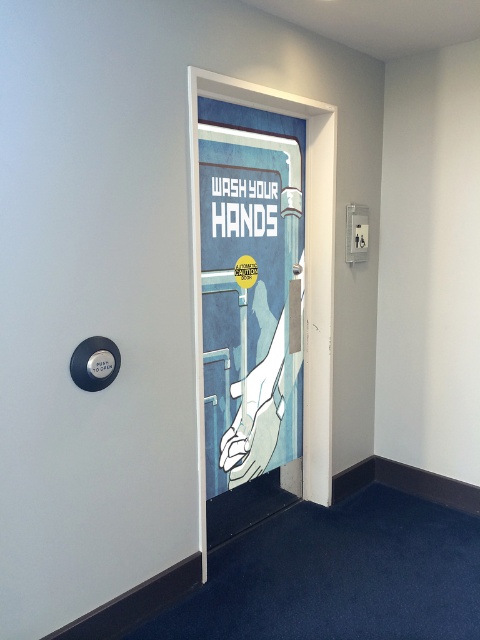
Who is positioned more to the right, white glossy door at center or blue paper poster at center?

blue paper poster at center is more to the right.

In the scene shown: Does white glossy door at center appear on the left side of blue paper poster at center?

Indeed, white glossy door at center is positioned on the left side of blue paper poster at center.

Does point (70, 29) come closer to viewer compared to point (261, 205)?

Yes, it is.

Where is `white glossy door at center`? The width and height of the screenshot is (480, 640). white glossy door at center is located at coordinates [93, 301].